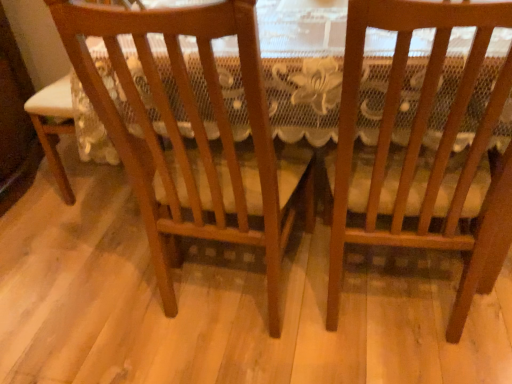
Describe the element at coordinates (421, 146) in the screenshot. I see `wooden chair at center, the 2th chair when ordered from left to right` at that location.

Locate an element on the screen. This screenshot has width=512, height=384. wooden chair at center, the 1th chair from the right is located at coordinates (421, 146).

Measure the distance between point (216, 120) and camera.

Point (216, 120) and camera are 32.83 inches apart from each other.

In order to face wooden chair at center, the first chair in the left-to-right sequence, should I rotate leftwards or rightwards?

It's best to rotate left around 4.217 degrees.

Identify the location of wooden chair at center, the first chair in the left-to-right sequence. pyautogui.click(x=194, y=136).

What do you see at coordinates (194, 136) in the screenshot?
I see `wooden chair at center, arranged as the 2th chair when viewed from the right` at bounding box center [194, 136].

Identify the location of wooden chair at center, the 2th chair when ordered from left to right. This screenshot has width=512, height=384. (421, 146).

Does wooden chair at center, arranged as the 2th chair when viewed from the right, appear on the left side of wooden chair at center, the 2th chair when ordered from left to right?

Indeed, wooden chair at center, arranged as the 2th chair when viewed from the right, is positioned on the left side of wooden chair at center, the 2th chair when ordered from left to right.

Which object is further away from the camera, wooden chair at center, the first chair in the left-to-right sequence, or wooden chair at center, the 2th chair when ordered from left to right?

A: wooden chair at center, the first chair in the left-to-right sequence, is further from the camera.

Is point (137, 158) farther from camera compared to point (344, 165)?

Yes, point (137, 158) is farther from viewer.

From the image's perspective, is wooden chair at center, the first chair in the left-to-right sequence, above wooden chair at center, the 2th chair when ordered from left to right?

Correct, wooden chair at center, the first chair in the left-to-right sequence, appears higher than wooden chair at center, the 2th chair when ordered from left to right, in the image.

From a real-world perspective, is wooden chair at center, arranged as the 2th chair when viewed from the right, on top of wooden chair at center, the 2th chair when ordered from left to right?

Indeed, from a real-world perspective, wooden chair at center, arranged as the 2th chair when viewed from the right, stands above wooden chair at center, the 2th chair when ordered from left to right.

Between wooden chair at center, the first chair in the left-to-right sequence, and wooden chair at center, the 1th chair from the right, which one has smaller width?

Thinner between the two is wooden chair at center, the 1th chair from the right.

Looking at this image, considering the relative sizes of wooden chair at center, arranged as the 2th chair when viewed from the right, and wooden chair at center, the 1th chair from the right, in the image provided, is wooden chair at center, arranged as the 2th chair when viewed from the right, shorter than wooden chair at center, the 1th chair from the right,?

No, wooden chair at center, arranged as the 2th chair when viewed from the right, is not shorter than wooden chair at center, the 1th chair from the right.

Who is smaller, wooden chair at center, arranged as the 2th chair when viewed from the right, or wooden chair at center, the 2th chair when ordered from left to right?

wooden chair at center, the 2th chair when ordered from left to right, is smaller.

Is wooden chair at center, the first chair in the left-to-right sequence, not within wooden chair at center, the 2th chair when ordered from left to right?

wooden chair at center, the first chair in the left-to-right sequence, lies outside wooden chair at center, the 2th chair when ordered from left to right,'s area.

Are wooden chair at center, arranged as the 2th chair when viewed from the right, and wooden chair at center, the 2th chair when ordered from left to right, beside each other?

wooden chair at center, arranged as the 2th chair when viewed from the right, is not next to wooden chair at center, the 2th chair when ordered from left to right, and they're not touching.

Is wooden chair at center, arranged as the 2th chair when viewed from the right, facing towards wooden chair at center, the 1th chair from the right?

No, wooden chair at center, arranged as the 2th chair when viewed from the right, is not aimed at wooden chair at center, the 1th chair from the right.

Find the location of `chair below the wooden chair at center, the first chair in the left-to-right sequence (from the image's perspective)`. chair below the wooden chair at center, the first chair in the left-to-right sequence (from the image's perspective) is located at coordinates (421, 146).

Between wooden chair at center, the 1th chair from the right, and wooden chair at center, arranged as the 2th chair when viewed from the right, which one appears on the right side from the viewer's perspective?

From the viewer's perspective, wooden chair at center, the 1th chair from the right, appears more on the right side.

Who is more distant, wooden chair at center, the 1th chair from the right, or wooden chair at center, arranged as the 2th chair when viewed from the right?

wooden chair at center, arranged as the 2th chair when viewed from the right.

Does point (400, 61) appear closer or farther from the camera than point (194, 176)?

Clearly, point (400, 61) is closer to the camera than point (194, 176).

From the image's perspective, which object appears higher, wooden chair at center, the 1th chair from the right, or wooden chair at center, the first chair in the left-to-right sequence?

wooden chair at center, the first chair in the left-to-right sequence, from the image's perspective.

From a real-world perspective, does wooden chair at center, the 1th chair from the right, stand above wooden chair at center, arranged as the 2th chair when viewed from the right?

Incorrect, from a real-world perspective, wooden chair at center, the 1th chair from the right, is lower than wooden chair at center, arranged as the 2th chair when viewed from the right.

Can you confirm if wooden chair at center, the 1th chair from the right, is wider than wooden chair at center, arranged as the 2th chair when viewed from the right?

No.

Does wooden chair at center, the 1th chair from the right, have a greater height compared to wooden chair at center, the first chair in the left-to-right sequence?

In fact, wooden chair at center, the 1th chair from the right, may be shorter than wooden chair at center, the first chair in the left-to-right sequence.

Can you confirm if wooden chair at center, the 1th chair from the right, is bigger than wooden chair at center, arranged as the 2th chair when viewed from the right?

Incorrect, wooden chair at center, the 1th chair from the right, is not larger than wooden chair at center, arranged as the 2th chair when viewed from the right.

Would you say wooden chair at center, the first chair in the left-to-right sequence, is part of wooden chair at center, the 2th chair when ordered from left to right,'s contents?

No, wooden chair at center, the first chair in the left-to-right sequence, is located outside of wooden chair at center, the 2th chair when ordered from left to right.

Does wooden chair at center, the 2th chair when ordered from left to right, touch wooden chair at center, arranged as the 2th chair when viewed from the right?

wooden chair at center, the 2th chair when ordered from left to right, is not next to wooden chair at center, arranged as the 2th chair when viewed from the right, and they're not touching.

Does wooden chair at center, the 1th chair from the right, turn towards wooden chair at center, arranged as the 2th chair when viewed from the right?

No, wooden chair at center, the 1th chair from the right, does not turn towards wooden chair at center, arranged as the 2th chair when viewed from the right.

What's the angular difference between wooden chair at center, the 1th chair from the right, and wooden chair at center, the first chair in the left-to-right sequence,'s facing directions?

There is a 5.32-degree angle between the facing directions of wooden chair at center, the 1th chair from the right, and wooden chair at center, the first chair in the left-to-right sequence.

Identify the location of chair that is above the wooden chair at center, the 1th chair from the right (from a real-world perspective). This screenshot has height=384, width=512. (194, 136).

This screenshot has height=384, width=512. I want to click on chair lying above the wooden chair at center, the 2th chair when ordered from left to right (from the image's perspective), so pyautogui.click(x=194, y=136).

Find the location of a particular element. Image resolution: width=512 pixels, height=384 pixels. chair that is under the wooden chair at center, the first chair in the left-to-right sequence (from a real-world perspective) is located at coordinates (421, 146).